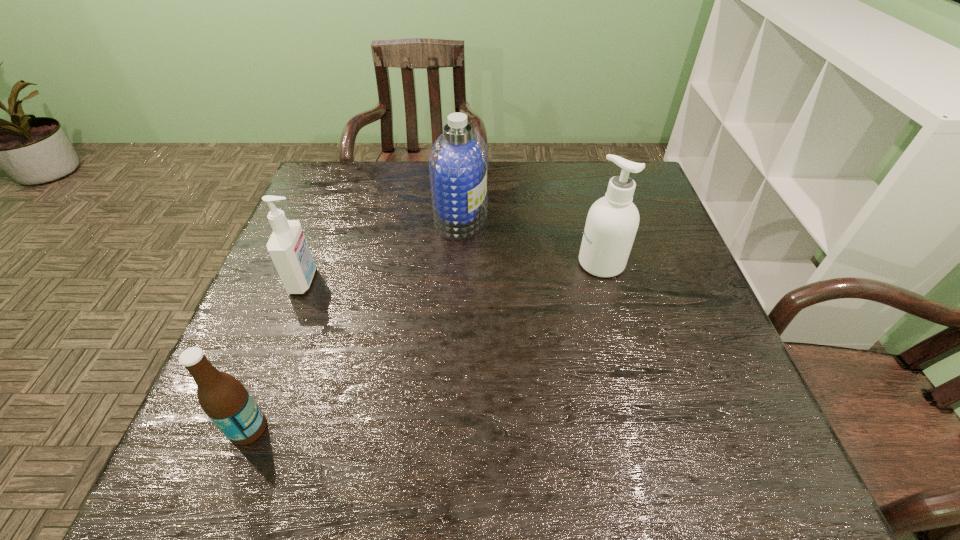
In the image, there is a desktop. At what (x,y) coordinates should I click in order to perform the action: click on vacant area at the right edge. Please return your answer as a coordinate pair (x, y). Image resolution: width=960 pixels, height=540 pixels. Looking at the image, I should click on click(666, 295).

Where is `vacant region at the far left corner of the desktop`? vacant region at the far left corner of the desktop is located at coordinates (326, 192).

Find the location of a particular element. The image size is (960, 540). free space at the far right corner of the desktop is located at coordinates (612, 174).

Locate an element on the screen. The height and width of the screenshot is (540, 960). blank region between the leftmost cleansing agent and the second cleansing agent from right to left is located at coordinates (382, 249).

Find the location of a particular element. This screenshot has height=540, width=960. free spot between the nearest object and the farthest cleansing agent is located at coordinates click(355, 323).

The width and height of the screenshot is (960, 540). In order to click on vacant space in between the nearest object and the leftmost cleansing agent in this screenshot , I will do pos(276,354).

The image size is (960, 540). I want to click on empty location between the shortest cleansing agent and the farthest cleansing agent, so click(x=382, y=249).

Where is `empty location between the nearest object and the rightmost object`? The height and width of the screenshot is (540, 960). empty location between the nearest object and the rightmost object is located at coordinates (425, 346).

Where is `free space between the rightmost cleansing agent and the beer bottle`? free space between the rightmost cleansing agent and the beer bottle is located at coordinates (425, 346).

You are a GUI agent. You are given a task and a screenshot of the screen. Output one action in this format:
    pyautogui.click(x=<x>, y=<y>)
    Task: Click on the vacant space that's between the shortest cleansing agent and the second object from right to left
    This screenshot has height=540, width=960.
    Given the screenshot: What is the action you would take?
    pyautogui.click(x=382, y=249)